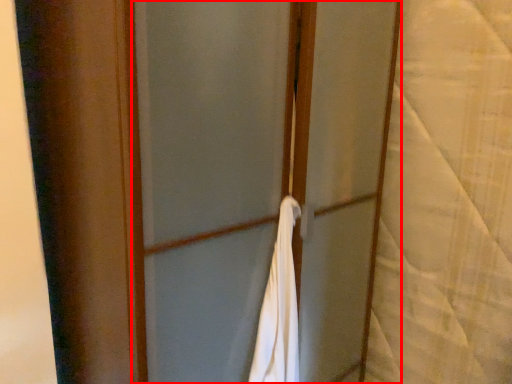
Question: Where is screen door (annotated by the red box) located in relation to curtain in the image?

Choices:
 (A) right
 (B) left

Answer: (B)